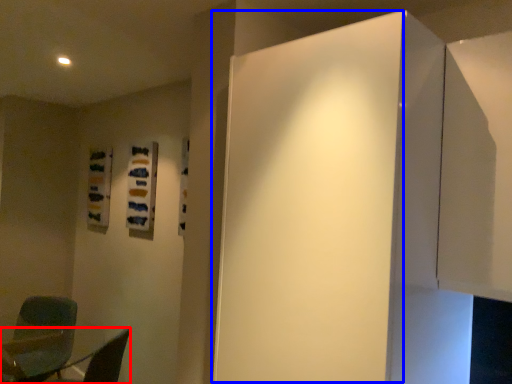
Question: Which object appears farthest to the camera in this image, furniture (highlighted by a red box) or door (highlighted by a blue box)?

Choices:
 (A) furniture
 (B) door

Answer: (A)